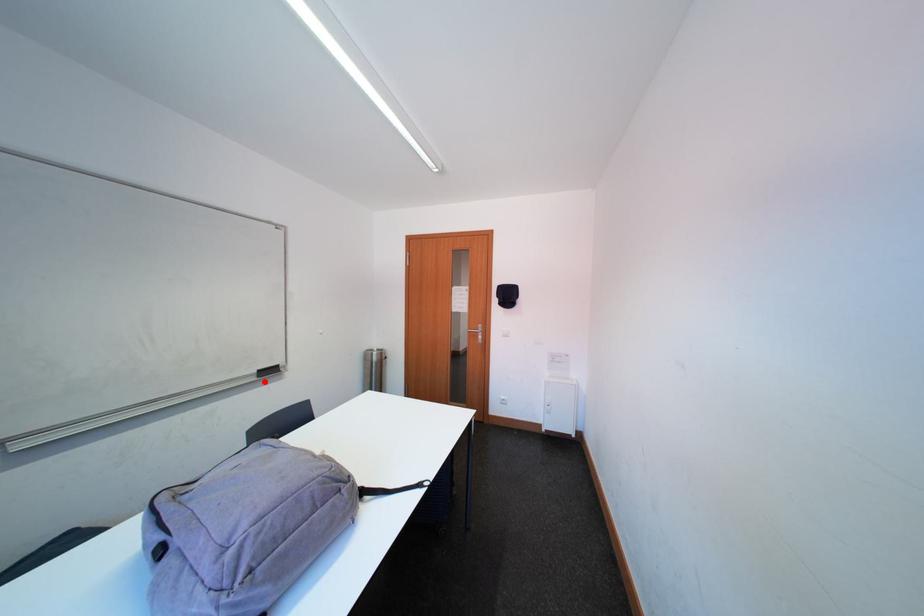
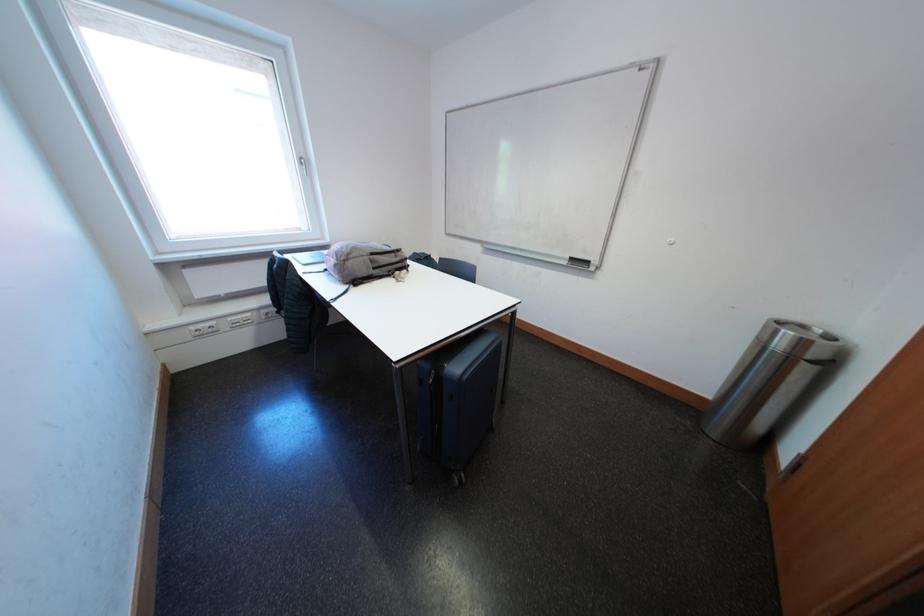
Question: I am providing you with two images of the same scene from different viewpoints. A red point is shown in image1. For the corresponding object point in image2, is it positioned nearer or farther from the camera?

Choices:
 (A) Nearer
 (B) Farther

Answer: (A)